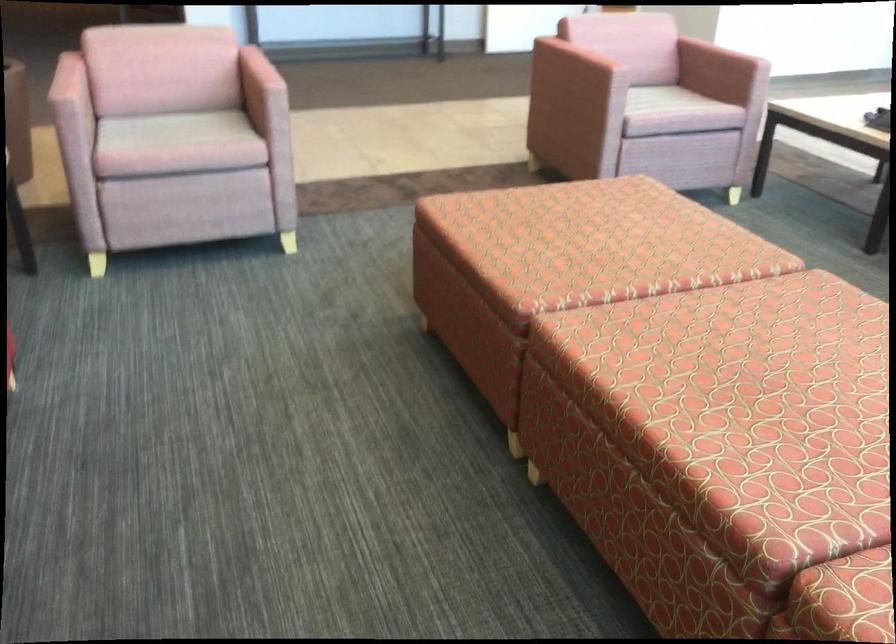
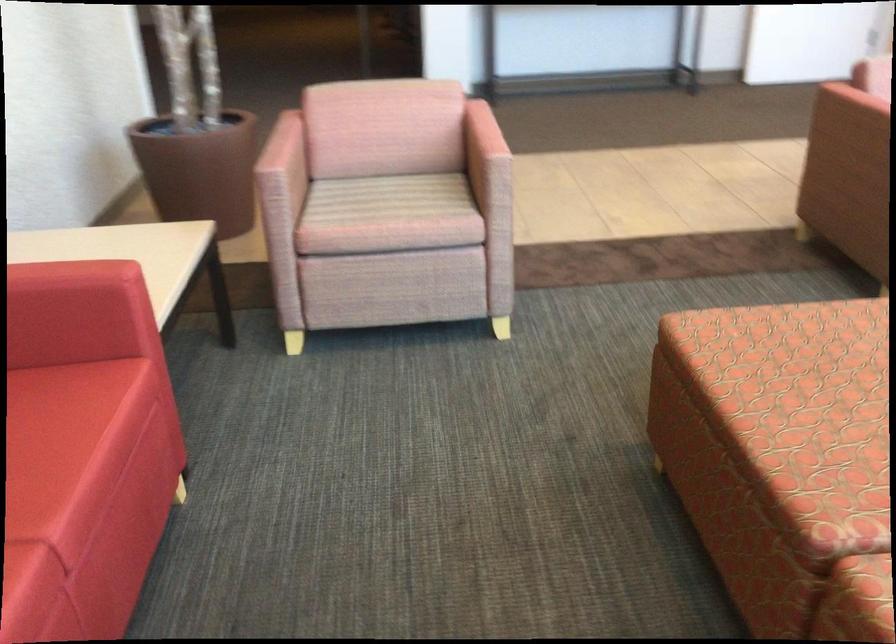
In the second image, find the point that corresponds to (x=510, y=214) in the first image.

(782, 350)